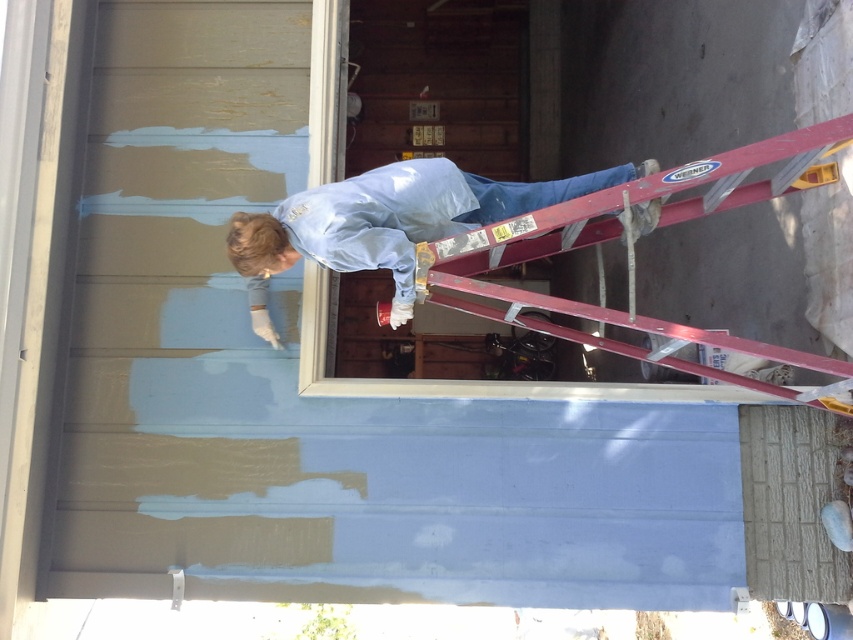
You are a painter who needs to reach the light blue fabric at upper center while standing on the metallic red ladder at upper right. Can you safely reach it without moving the ladder?

The distance between the metallic red ladder at upper right and the light blue fabric at upper center is 32.37 centimeters. Since the ladder provides a stable platform, you can safely reach the light blue fabric at upper center from your current position on the ladder without needing to move it.

You are a painter standing on the ground looking at the metallic red ladder at upper right and the light blue fabric at upper center. Which object is closer to you?

The metallic red ladder at upper right is closer to you because it is in front of the light blue fabric at upper center.

You are standing at the origin point of the image coordinate system. The metallic red ladder at upper right is located at point 0.353, 0.774. If you want to move towards the ladder, which direction should you move in terms of the coordinate system?

To move towards the metallic red ladder at upper right located at point (x=659, y=225), you should move in the positive x and y directions since the ladder is at a higher x and y coordinate than the origin.